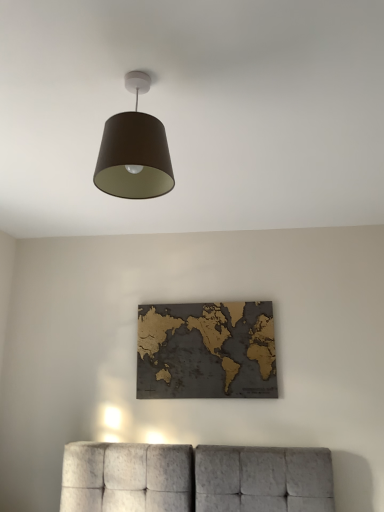
Question: Considering the relative positions of gold textured map at center and matte brown shade at upper center in the image provided, is gold textured map at center to the right of matte brown shade at upper center from the viewer's perspective?

Choices:
 (A) yes
 (B) no

Answer: (A)

Question: Is gold textured map at center aimed at matte brown shade at upper center?

Choices:
 (A) yes
 (B) no

Answer: (A)

Question: Is gold textured map at center smaller than matte brown shade at upper center?

Choices:
 (A) no
 (B) yes

Answer: (B)

Question: From a real-world perspective, is gold textured map at center positioned over matte brown shade at upper center based on gravity?

Choices:
 (A) no
 (B) yes

Answer: (A)

Question: Considering the relative sizes of gold textured map at center and matte brown shade at upper center in the image provided, is gold textured map at center taller than matte brown shade at upper center?

Choices:
 (A) yes
 (B) no

Answer: (A)

Question: Is gold textured map at center positioned in front of matte brown shade at upper center?

Choices:
 (A) no
 (B) yes

Answer: (A)

Question: From a real-world perspective, is matte brown shade at upper center beneath gold textured map at center?

Choices:
 (A) yes
 (B) no

Answer: (B)

Question: Is matte brown shade at upper center not near gold textured map at center?

Choices:
 (A) yes
 (B) no

Answer: (A)

Question: Does matte brown shade at upper center turn towards gold textured map at center?

Choices:
 (A) no
 (B) yes

Answer: (A)

Question: Is the depth of matte brown shade at upper center greater than that of gold textured map at center?

Choices:
 (A) no
 (B) yes

Answer: (A)

Question: From a real-world perspective, is matte brown shade at upper center located higher than gold textured map at center?

Choices:
 (A) no
 (B) yes

Answer: (B)

Question: Is matte brown shade at upper center taller than gold textured map at center?

Choices:
 (A) yes
 (B) no

Answer: (B)

Question: In terms of size, does gold textured map at center appear bigger or smaller than matte brown shade at upper center?

Choices:
 (A) big
 (B) small

Answer: (B)